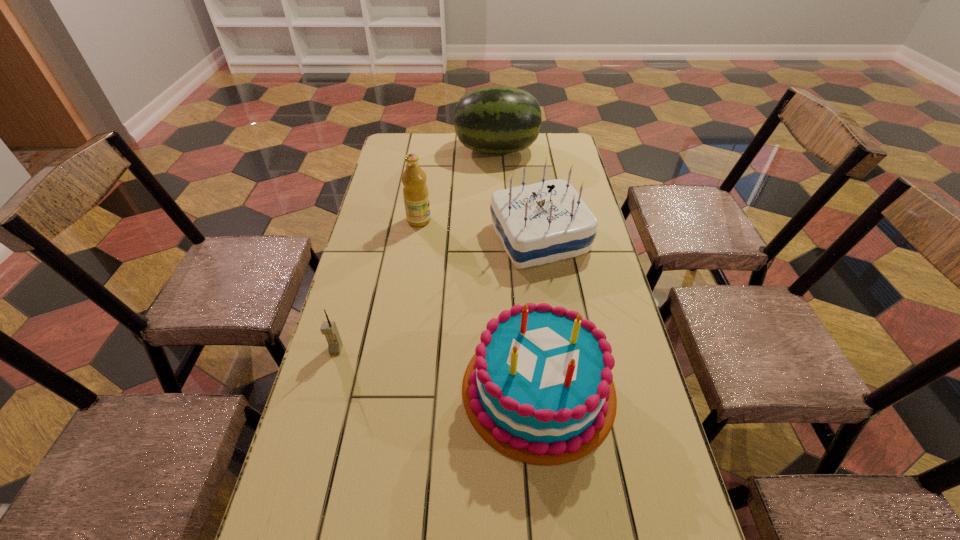
Where is `object identified as the third closest to the farther birthday cake`? This screenshot has height=540, width=960. object identified as the third closest to the farther birthday cake is located at coordinates point(498,119).

Identify the location of vacant space that satisfies the following two spatial constraints: 1. on the label of the fourth object from right to left; 2. on the front of the leftmost object, where the keypad is located. This screenshot has width=960, height=540. (398, 349).

Where is `free space that satisfies the following two spatial constraints: 1. on the front side of the watermelon; 2. on the left side of the farther birthday cake`? free space that satisfies the following two spatial constraints: 1. on the front side of the watermelon; 2. on the left side of the farther birthday cake is located at coordinates (501, 238).

Image resolution: width=960 pixels, height=540 pixels. Identify the location of vacant space that satisfies the following two spatial constraints: 1. on the front of the nearer birthday cake, where the keypad is located; 2. on the right side of the shortest object. (325, 389).

Locate an element on the screen. free space that satisfies the following two spatial constraints: 1. on the label of the olive oil; 2. on the left side of the farther birthday cake is located at coordinates (417, 238).

Identify the location of vacant region that satisfies the following two spatial constraints: 1. on the label of the second object from left to right; 2. on the right side of the nearer birthday cake. This screenshot has height=540, width=960. (393, 389).

Where is `vacant area in the image that satisfies the following two spatial constraints: 1. on the front of the leftmost object, where the keypad is located; 2. on the left side of the nearer birthday cake`? vacant area in the image that satisfies the following two spatial constraints: 1. on the front of the leftmost object, where the keypad is located; 2. on the left side of the nearer birthday cake is located at coordinates (325, 389).

The image size is (960, 540). I want to click on vacant area that satisfies the following two spatial constraints: 1. on the front of the nearer birthday cake, where the keypad is located; 2. on the right side of the cellular telephone, so click(325, 389).